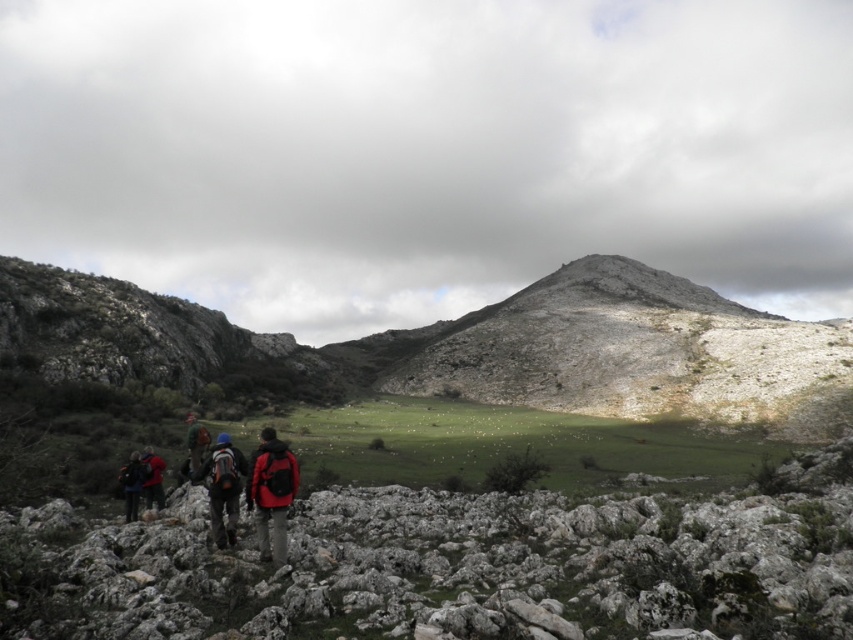
You are a hiker planning to carry both the matte red backpack at center and the matte black backpack at center. Since you can only carry one backpack at a time, which one would you choose if you need to carry more supplies?

The matte red backpack at center has a larger size compared to the matte black backpack at center, so you should choose the matte red backpack at center to carry more supplies.

You are a hiker preparing to descend the mountain. You have a matte red backpack at center and a red matte jacket at lower left. Which item takes up more space?

The matte red backpack at center is bigger than the red matte jacket at lower left, so it takes up more space.

You are a hiker who just arrived at the mountain trailhead. You see the matte black backpack at lower left. Where exactly should you place your GPS marker to locate it?

You should place the GPS marker at point (132, 484) to locate the matte black backpack at lower left.